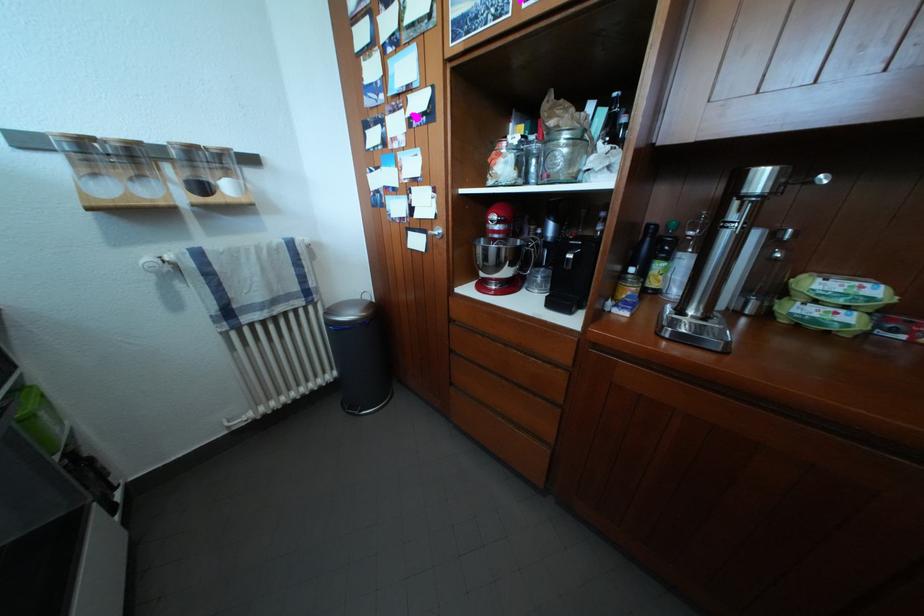
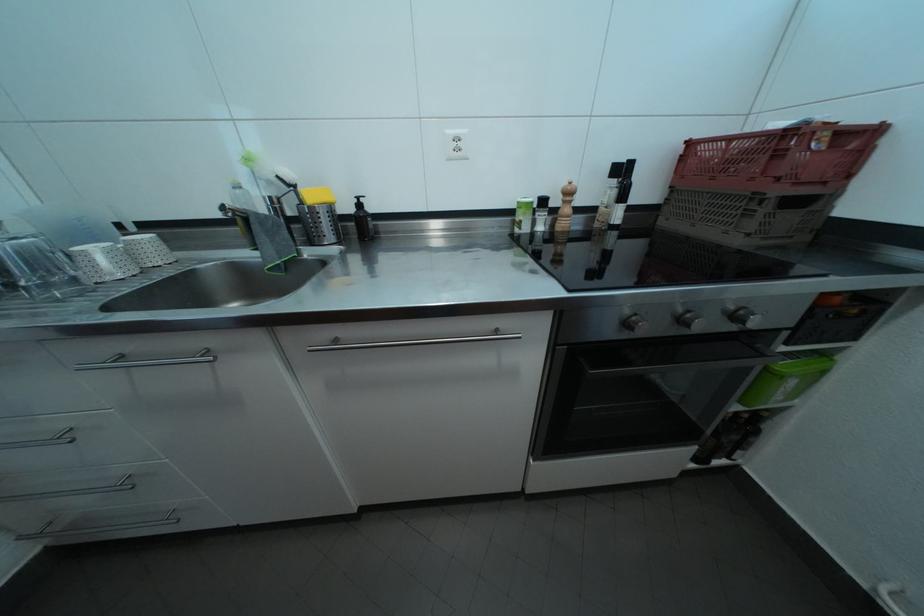
In the second image, find the point that corresponds to the point at 29,394 in the first image.

(833, 360)